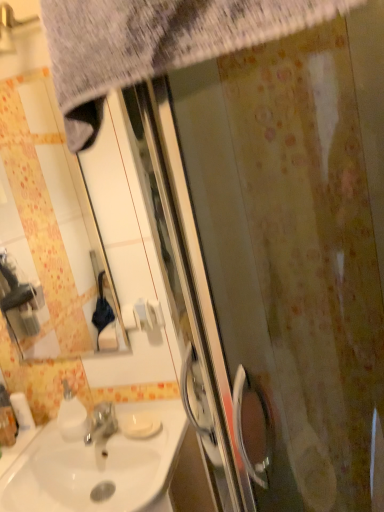
Question: Is matte white mirror at upper left not close to white glossy sink at lower left?

Choices:
 (A) no
 (B) yes

Answer: (B)

Question: Is the surface of matte white mirror at upper left in direct contact with white glossy sink at lower left?

Choices:
 (A) yes
 (B) no

Answer: (B)

Question: Does matte white mirror at upper left have a smaller size compared to white glossy sink at lower left?

Choices:
 (A) yes
 (B) no

Answer: (A)

Question: From a real-world perspective, does matte white mirror at upper left sit lower than white glossy sink at lower left?

Choices:
 (A) yes
 (B) no

Answer: (B)

Question: Considering the relative positions of matte white mirror at upper left and white glossy sink at lower left in the image provided, is matte white mirror at upper left to the left of white glossy sink at lower left from the viewer's perspective?

Choices:
 (A) no
 (B) yes

Answer: (B)

Question: In the image, is matte white mirror at upper left on the left side or the right side of textured gray towel at upper left?

Choices:
 (A) right
 (B) left

Answer: (B)

Question: From a real-world perspective, is matte white mirror at upper left physically located above or below textured gray towel at upper left?

Choices:
 (A) above
 (B) below

Answer: (B)

Question: Is matte white mirror at upper left situated inside textured gray towel at upper left or outside?

Choices:
 (A) inside
 (B) outside

Answer: (B)

Question: Considering their positions, is matte white mirror at upper left located in front of or behind textured gray towel at upper left?

Choices:
 (A) front
 (B) behind

Answer: (B)

Question: Choose the correct answer: Is white glossy soap dispenser at lower left inside matte white mirror at upper left or outside it?

Choices:
 (A) outside
 (B) inside

Answer: (A)

Question: In the image, is white glossy soap dispenser at lower left on the left side or the right side of matte white mirror at upper left?

Choices:
 (A) right
 (B) left

Answer: (B)

Question: In the image, is white glossy soap dispenser at lower left positioned in front of or behind matte white mirror at upper left?

Choices:
 (A) behind
 (B) front

Answer: (A)

Question: Looking at their shapes, would you say white glossy soap dispenser at lower left is wider or thinner than matte white mirror at upper left?

Choices:
 (A) wide
 (B) thin

Answer: (A)

Question: Looking at their shapes, would you say matte white mirror at upper left is wider or thinner than white glossy sink at lower left?

Choices:
 (A) wide
 (B) thin

Answer: (B)

Question: From a real-world perspective, is matte white mirror at upper left above or below white glossy sink at lower left?

Choices:
 (A) above
 (B) below

Answer: (A)